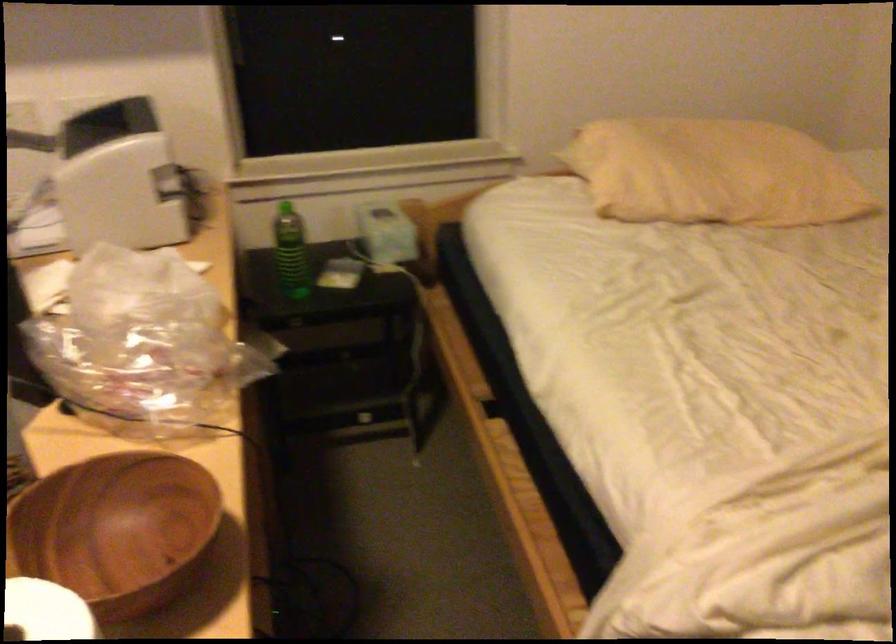
First-person continuous shooting, in which direction is the camera rotating?

The rotation direction of the camera is left-down.